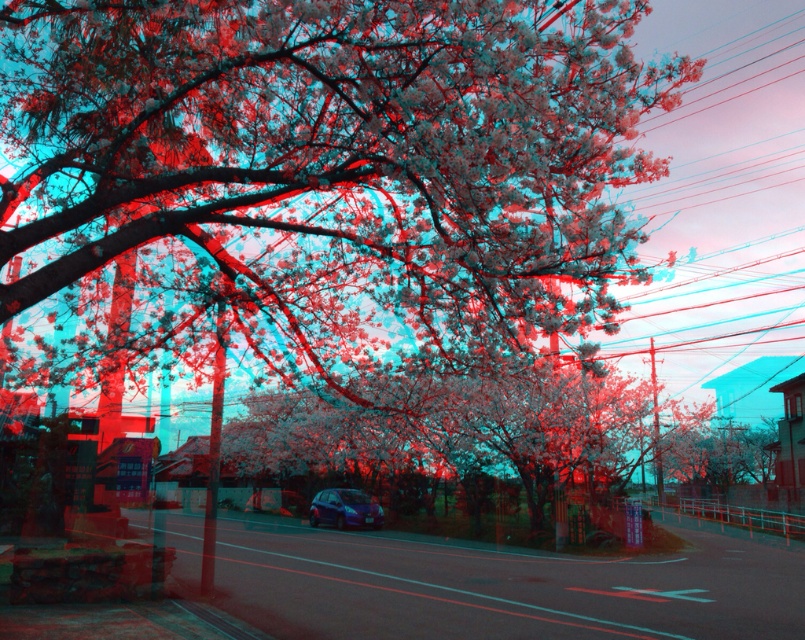
You are standing in the street scene and want to reach the white matte flower at upper center. Based on the distance provided, can you estimate whether you can comfortably reach it without any assistance?

The white matte flower at upper center is 8.54 meters away from the viewer, so you can comfortably reach it without any assistance as this distance is within a typical walking range.

You are a photographer standing in the street scene. You want to capture a photo where the white matte flower at upper center and the metallic blue hatchback at center are both visible. Which object should you position closer to the left side of your camera frame to include both in the shot?

Since the white matte flower at upper center is to the right of the metallic blue hatchback at center, you should position the metallic blue hatchback at center closer to the left side of your camera frame to ensure both objects are visible in the shot.

You are a photographer standing in the street scene and want to capture both the white matte flower at upper center and the metallic blue hatchback at center in a single photo. Which object will appear smaller in the photo?

The white matte flower at upper center will appear smaller in the photo because it has a lesser height compared to the metallic blue hatchback at center.